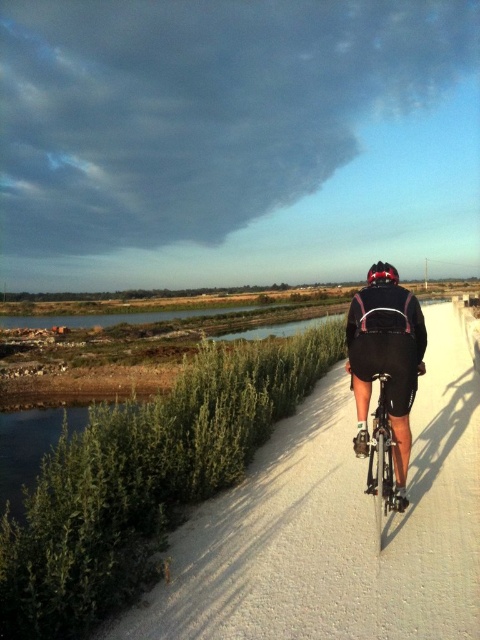
Question: Can you confirm if white textured path at center is positioned to the left of shiny metallic bicycle at center?

Choices:
 (A) no
 (B) yes

Answer: (A)

Question: Which is nearer to the black matte cycling suit at center?

Choices:
 (A) shiny metallic bicycle at center
 (B) matte black helmet at center

Answer: (A)

Question: Can you confirm if white textured path at center is positioned above matte black helmet at center?

Choices:
 (A) yes
 (B) no

Answer: (B)

Question: Estimate the real-world distances between objects in this image. Which object is closer to the matte black helmet at center?

Choices:
 (A) shiny metallic bicycle at center
 (B) black matte cycling suit at center
 (C) white textured path at center

Answer: (B)

Question: Estimate the real-world distances between objects in this image. Which object is closer to the matte black helmet at center?

Choices:
 (A) black matte cycling suit at center
 (B) shiny metallic bicycle at center
 (C) white textured path at center

Answer: (A)

Question: Does shiny metallic bicycle at center have a greater width compared to matte black helmet at center?

Choices:
 (A) yes
 (B) no

Answer: (B)